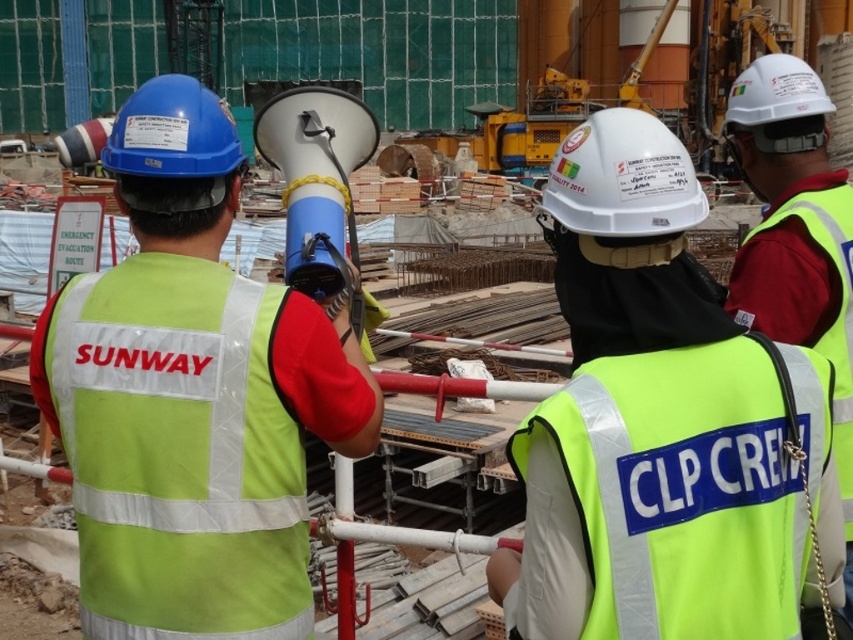
Between high visibility vest at center and yellow reflective safety vest at center, which one is positioned higher?

yellow reflective safety vest at center is higher up.

Between high visibility vest at center and yellow reflective safety vest at center, which one appears on the left side from the viewer's perspective?

high visibility vest at center is more to the left.

Is point (325, 362) positioned in front of point (837, 365)?

Yes, it is in front of point (837, 365).

The image size is (853, 640). I want to click on high visibility vest at center, so click(192, 396).

At what (x,y) coordinates should I click in order to perform the action: click on high visibility vest at center. Please return your answer as a coordinate pair (x, y). The height and width of the screenshot is (640, 853). Looking at the image, I should click on click(192, 396).

Who is shorter, yellow reflective vest at center or yellow reflective safety vest at center?

Standing shorter between the two is yellow reflective safety vest at center.

At what (x,y) coordinates should I click in order to perform the action: click on yellow reflective vest at center. Please return your answer as a coordinate pair (x, y). Looking at the image, I should click on (647, 420).